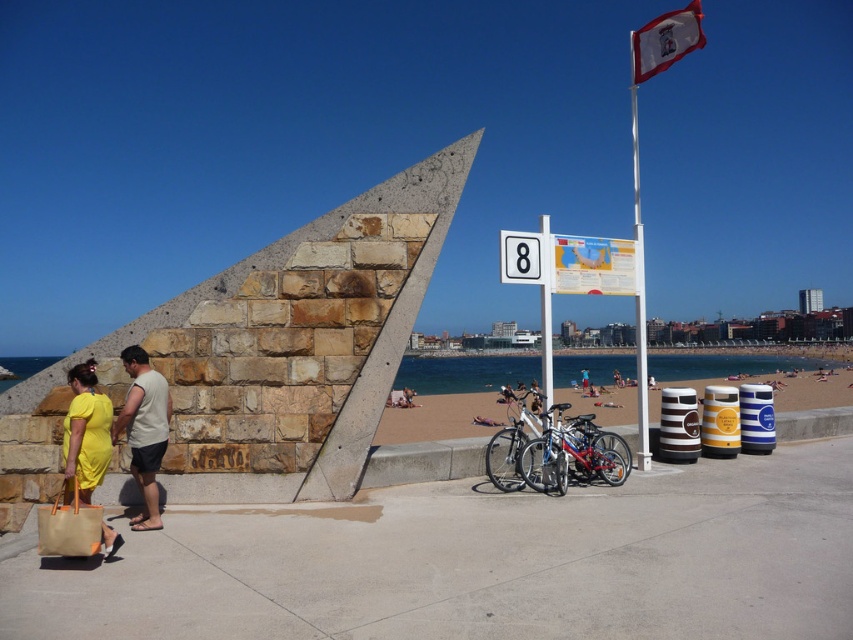
You are standing on the concrete walkway at the beach and see the yellow fabric bag at lower left. If you were to walk directly towards the bag, which direction should you move relative to your current position?

Since the yellow fabric bag at lower left is located at point (86, 432) in 2D coordinates, you should move towards the lower left direction to reach it.

You are standing at the starting point of the concrete walkway and want to reach the metallic silver bicycle at center. Which direction should you walk to reach it?

Walk straight ahead along the concrete walkway towards the center of the image to reach the metallic silver bicycle at center.